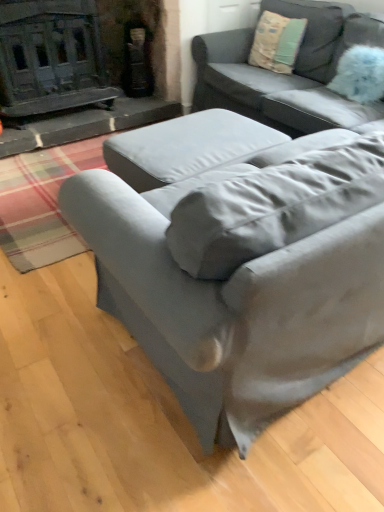
Question: Is blue fluffy pillow at upper right smaller than satin gray couch at lower right, which is counted as the 2th studio couch, starting from the back?

Choices:
 (A) no
 (B) yes

Answer: (B)

Question: Does blue fluffy pillow at upper right turn towards satin gray couch at lower right, which is the 1th studio couch from front to back?

Choices:
 (A) yes
 (B) no

Answer: (B)

Question: Is blue fluffy pillow at upper right oriented away from satin gray couch at lower right, which is the 1th studio couch from front to back?

Choices:
 (A) yes
 (B) no

Answer: (B)

Question: Does blue fluffy pillow at upper right have a larger size compared to satin gray couch at lower right, which is the 1th studio couch from front to back?

Choices:
 (A) no
 (B) yes

Answer: (A)

Question: Is blue fluffy pillow at upper right to the left of satin gray couch at lower right, which is the 1th studio couch from front to back, from the viewer's perspective?

Choices:
 (A) yes
 (B) no

Answer: (B)

Question: Based on their sizes in the image, would you say satin gray couch at lower right, which is counted as the 2th studio couch, starting from the back, is bigger or smaller than textured beige pillow at upper right?

Choices:
 (A) big
 (B) small

Answer: (A)

Question: Is satin gray couch at lower right, which is the 1th studio couch from front to back, inside or outside of textured beige pillow at upper right?

Choices:
 (A) outside
 (B) inside

Answer: (A)

Question: Is point (309, 224) positioned closer to the camera than point (276, 65)?

Choices:
 (A) closer
 (B) farther

Answer: (A)

Question: Considering the positions of satin gray couch at lower right, which is the 1th studio couch from front to back, and textured beige pillow at upper right in the image, is satin gray couch at lower right, which is the 1th studio couch from front to back, wider or thinner than textured beige pillow at upper right?

Choices:
 (A) thin
 (B) wide

Answer: (B)

Question: From a real-world perspective, is textured beige pillow at upper right above or below satin gray couch at lower right, which is counted as the 2th studio couch, starting from the back?

Choices:
 (A) above
 (B) below

Answer: (A)

Question: Is textured beige pillow at upper right wider or thinner than satin gray couch at lower right, which is the 1th studio couch from front to back?

Choices:
 (A) wide
 (B) thin

Answer: (B)

Question: Is textured beige pillow at upper right in front of or behind satin gray couch at lower right, which is counted as the 2th studio couch, starting from the back, in the image?

Choices:
 (A) front
 (B) behind

Answer: (B)

Question: From the image's perspective, is textured beige pillow at upper right located above or below satin gray couch at lower right, which is counted as the 2th studio couch, starting from the back?

Choices:
 (A) below
 (B) above

Answer: (B)

Question: In terms of size, does textured beige pillow at upper right appear bigger or smaller than blue fluffy pillow at upper right?

Choices:
 (A) big
 (B) small

Answer: (A)

Question: Considering the positions of textured beige pillow at upper right and blue fluffy pillow at upper right in the image, is textured beige pillow at upper right taller or shorter than blue fluffy pillow at upper right?

Choices:
 (A) short
 (B) tall

Answer: (B)